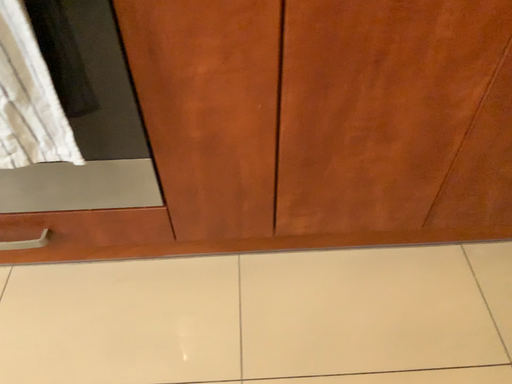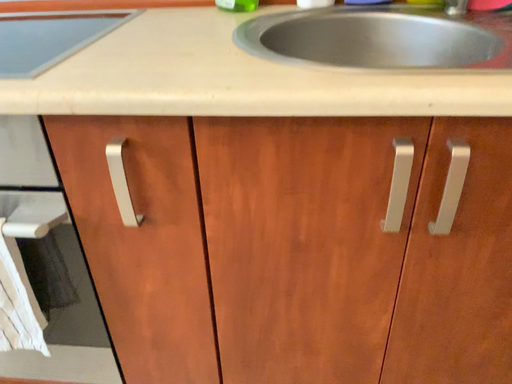
Question: How did the camera likely rotate when shooting the video?

Choices:
 (A) rotated upward
 (B) rotated downward

Answer: (A)